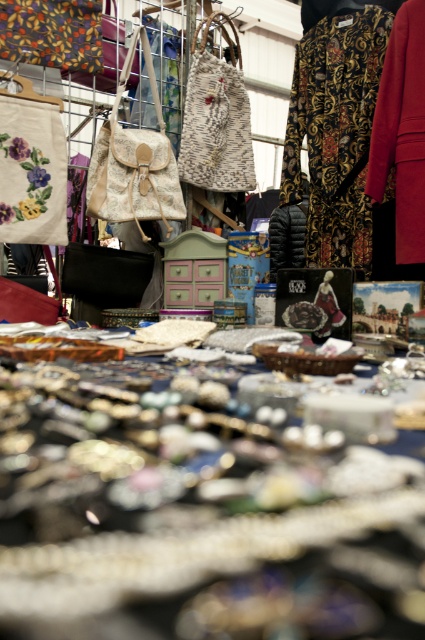
Is point (374, 10) farther from viewer compared to point (303, 241)?

No, it is not.

Between point (342, 120) and point (291, 220), which one is positioned behind?

Point (291, 220)

This screenshot has width=425, height=640. Find the location of `patterned fabric dress at upper right`. patterned fabric dress at upper right is located at coordinates (334, 129).

Does velvet red coat at right appear on the right side of matte black puffer jacket at center?

Correct, you'll find velvet red coat at right to the right of matte black puffer jacket at center.

Is velvet red coat at right below matte black puffer jacket at center?

Incorrect, velvet red coat at right is not positioned below matte black puffer jacket at center.

I want to click on velvet red coat at right, so tap(402, 132).

Can you confirm if patterned fabric dress at upper right is positioned to the right of velvet red coat at right?

No, patterned fabric dress at upper right is not to the right of velvet red coat at right.

Measure the distance between patterned fabric dress at upper right and velvet red coat at right.

patterned fabric dress at upper right is 8.18 inches from velvet red coat at right.

Find the location of a particular element. This screenshot has width=425, height=640. patterned fabric dress at upper right is located at coordinates (334, 129).